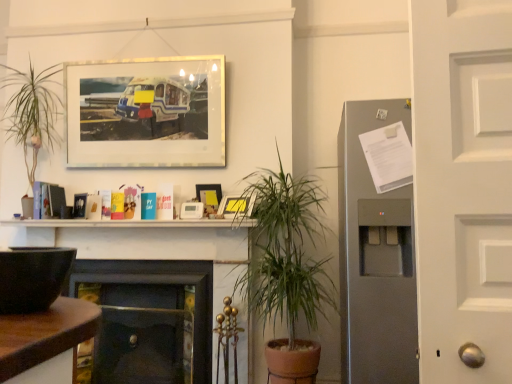
Question: From the image's perspective, is matte glass picture frame at upper center, the 3th picture frame in the bottom-to-top sequence, above or below matte wooden picture frame at center, the second picture frame in the top-to-bottom sequence?

Choices:
 (A) below
 (B) above

Answer: (B)

Question: Is matte glass picture frame at upper center, the first picture frame in the top-to-bottom sequence, inside the boundaries of matte wooden picture frame at center, marked as the 2th picture frame in a bottom-to-top arrangement, or outside?

Choices:
 (A) inside
 (B) outside

Answer: (B)

Question: Which of these objects is positioned closest to the dark wood fireplace at center, which is counted as the second fireplace, starting from the left?

Choices:
 (A) green leafy plant at center
 (B) matte plastic picture frame at upper center, acting as the third picture frame starting from the left
 (C) dark wood fireplace at center, which ranks as the third fireplace in right-to-left order
 (D) satin silver refrigerator at right, the first fireplace when ordered from right to left
 (E) matte wooden picture frame at center, the second picture frame from the right

Answer: (C)

Question: Which of these objects is positioned farthest from the dark wood fireplace at center, which ranks as the first fireplace in left-to-right order?

Choices:
 (A) green leafy plant at center
 (B) white matte books at center
 (C) matte wooden picture frame at center, marked as the 2th picture frame in a bottom-to-top arrangement
 (D) satin silver refrigerator at right, the first fireplace when ordered from right to left
 (E) matte glass picture frame at upper center, which ranks as the 3th picture frame in right-to-left order

Answer: (D)